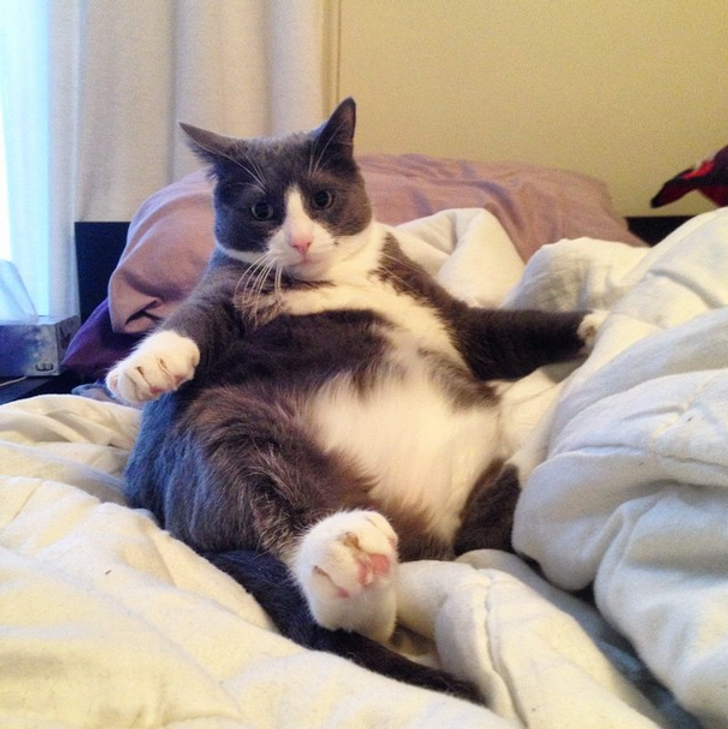
I want to click on bed, so click(x=98, y=587).